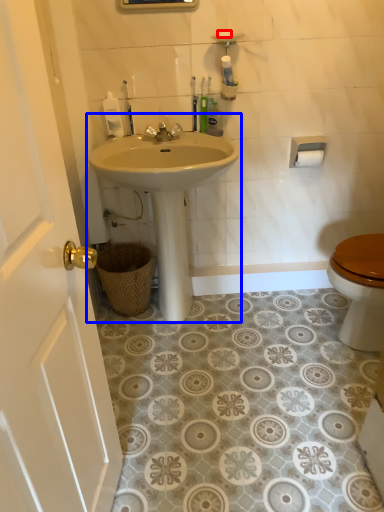
Question: Which point is further to the camera, soap (highlighted by a red box) or sink (highlighted by a blue box)?

Choices:
 (A) soap
 (B) sink

Answer: (A)